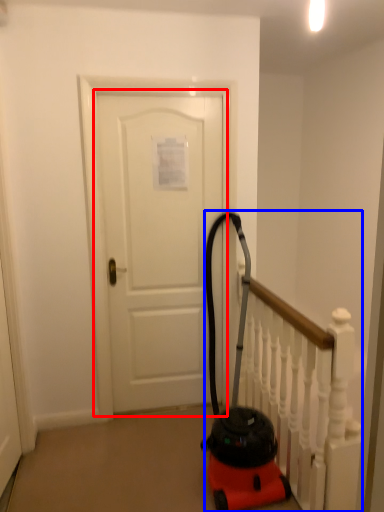
Question: Which object appears closest to the camera in this image, door (highlighted by a red box) or rail (highlighted by a blue box)?

Choices:
 (A) door
 (B) rail

Answer: (B)